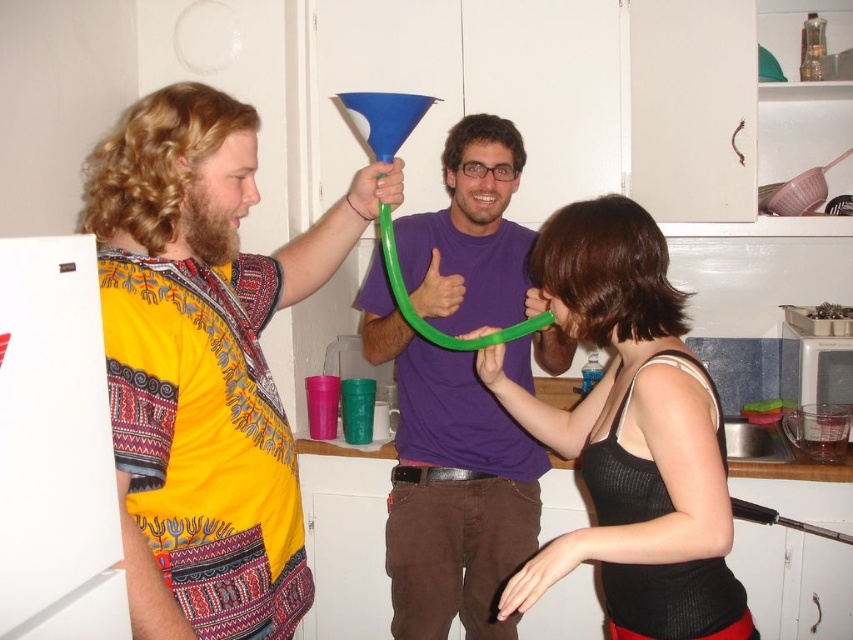
Question: Which point appears closest to the camera in this image?

Choices:
 (A) (518, 225)
 (B) (138, 456)
 (C) (544, 408)

Answer: (B)

Question: Is matte yellow shirt at center above purple matte shirt at center?

Choices:
 (A) no
 (B) yes

Answer: (B)

Question: Which point is farther to the camera?

Choices:
 (A) (634, 484)
 (B) (456, 147)

Answer: (B)

Question: Estimate the real-world distances between objects in this image. Which object is farther from the purple matte shirt at center?

Choices:
 (A) black ribbed tank top at center
 (B) matte yellow shirt at center

Answer: (B)

Question: Is matte yellow shirt at center wider than black ribbed tank top at center?

Choices:
 (A) no
 (B) yes

Answer: (B)

Question: Is black ribbed tank top at center to the right of purple matte shirt at center from the viewer's perspective?

Choices:
 (A) no
 (B) yes

Answer: (B)